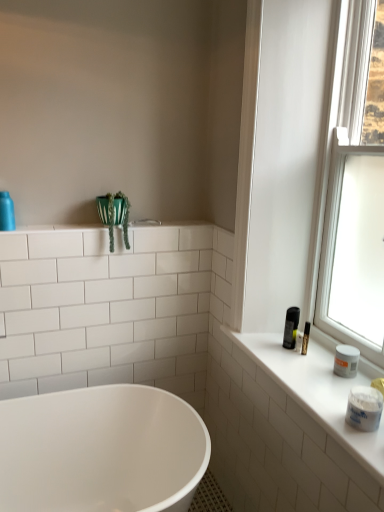
I want to click on vacant space positioned to the left of white matte jar at right, acting as the first toiletry starting from the right, so click(x=330, y=409).